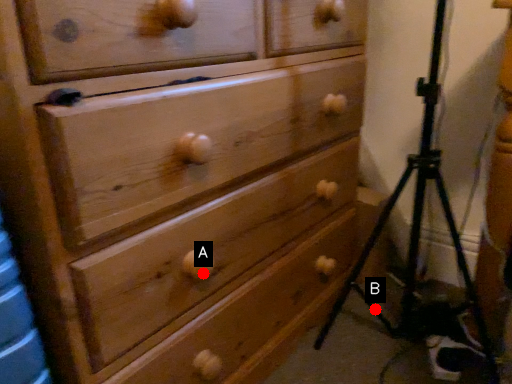
Question: Two points are circled on the image, labeled by A and B beside each circle. Which point appears farthest from the camera in this image?

Choices:
 (A) A is further
 (B) B is further

Answer: (B)